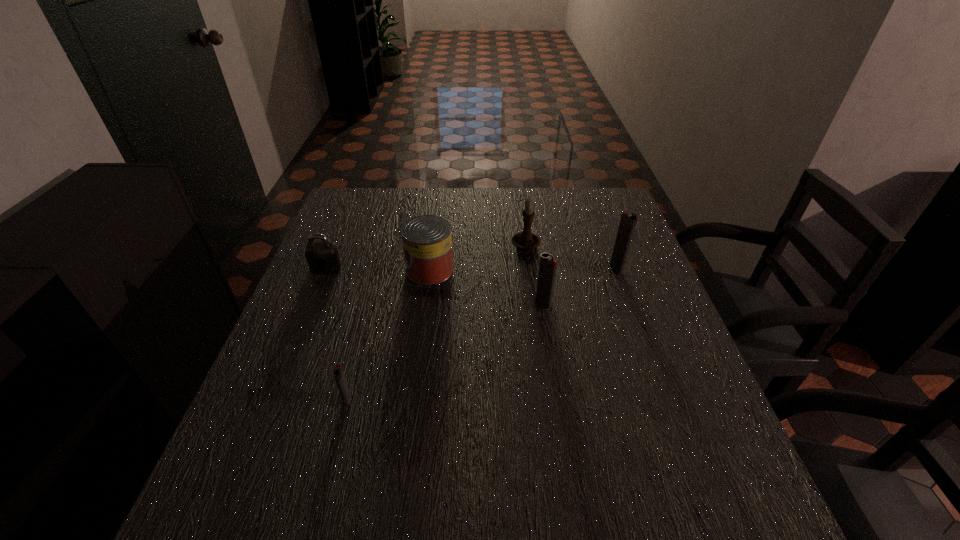
To achieve even spacing by inserting another igniter among them, please point to a vacant spot for this new igniter. Please provide its 2D coordinates. Your answer should be formatted as a tuple, i.e. [(x, y)], where the tuple contains the x and y coordinates of a point satisfying the conditions above.

[(456, 347)]